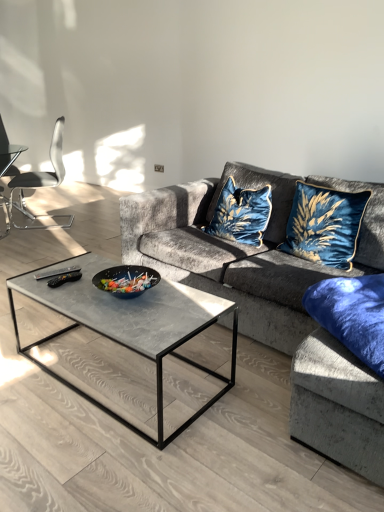
Question: Is concrete gray coffee table at center smaller than metallic silver chair at left?

Choices:
 (A) yes
 (B) no

Answer: (A)

Question: Is concrete gray coffee table at center wider than metallic silver chair at left?

Choices:
 (A) yes
 (B) no

Answer: (B)

Question: Is concrete gray coffee table at center bigger than metallic silver chair at left?

Choices:
 (A) no
 (B) yes

Answer: (A)

Question: Is the depth of concrete gray coffee table at center greater than that of metallic silver chair at left?

Choices:
 (A) yes
 (B) no

Answer: (A)

Question: From a real-world perspective, is concrete gray coffee table at center on metallic silver chair at left?

Choices:
 (A) yes
 (B) no

Answer: (B)

Question: Is metallic silver chair at left completely or partially inside concrete gray coffee table at center?

Choices:
 (A) yes
 (B) no

Answer: (B)

Question: Is concrete gray coffee table at center bigger than blue velvet pillow at lower right?

Choices:
 (A) no
 (B) yes

Answer: (B)

Question: Could you tell me if concrete gray coffee table at center is turned towards blue velvet pillow at lower right?

Choices:
 (A) yes
 (B) no

Answer: (A)

Question: Is concrete gray coffee table at center not within blue velvet pillow at lower right?

Choices:
 (A) yes
 (B) no

Answer: (A)

Question: Is blue velvet pillow at lower right at the back of concrete gray coffee table at center?

Choices:
 (A) no
 (B) yes

Answer: (A)

Question: Can you confirm if concrete gray coffee table at center is taller than blue velvet pillow at lower right?

Choices:
 (A) yes
 (B) no

Answer: (A)

Question: Can you confirm if concrete gray coffee table at center is shorter than blue velvet pillow at lower right?

Choices:
 (A) no
 (B) yes

Answer: (A)

Question: Is velvet blue cat-shaped pillow at center, which appears as the 2th throw pillow when viewed from the right, thinner than velvet blue cushion at upper right, the 2th throw pillow when ordered from left to right?

Choices:
 (A) no
 (B) yes

Answer: (A)